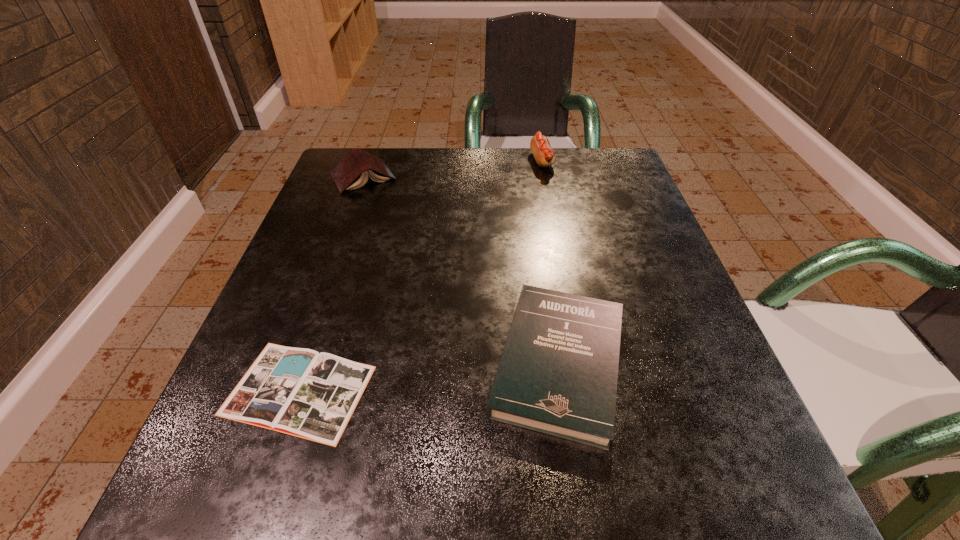
At what (x,y) coordinates should I click in order to perform the action: click on empty space that is in between the rightmost book and the sausage. Please return your answer as a coordinate pair (x, y). Looking at the image, I should click on (550, 262).

What are the coordinates of `free spot between the shortest object and the rightmost book` in the screenshot? It's located at pos(429,376).

This screenshot has height=540, width=960. Find the location of `unoccupied position between the tallest book and the shortest object`. unoccupied position between the tallest book and the shortest object is located at coordinates (331, 284).

Identify the location of unoccupied area between the farthest book and the shortest book. The width and height of the screenshot is (960, 540). (x=331, y=284).

This screenshot has height=540, width=960. Find the location of `free space that is in between the sausage and the shortest book`. free space that is in between the sausage and the shortest book is located at coordinates click(x=420, y=275).

Find the location of a particular element. free spot between the sausage and the second shortest book is located at coordinates (550, 262).

Identify the location of vacant point located between the second shortest book and the shortest object. (429, 376).

The height and width of the screenshot is (540, 960). I want to click on the closest object to the shortest book, so click(558, 374).

At what (x,y) coordinates should I click in order to perform the action: click on object that can be found as the third closest to the sausage. Please return your answer as a coordinate pair (x, y). The width and height of the screenshot is (960, 540). Looking at the image, I should click on (297, 391).

Where is `book that is the second closest to the shortest book`? book that is the second closest to the shortest book is located at coordinates (352, 171).